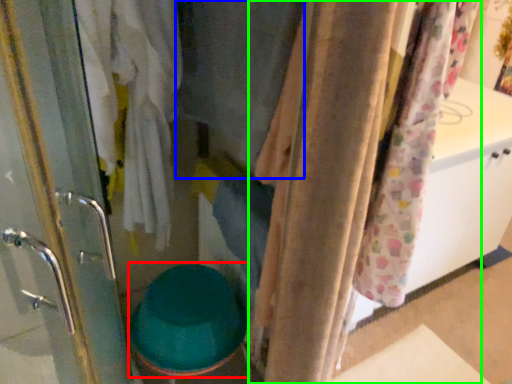
Question: Which is nearer to the toilet bowl (highlighted by a red box)? clothing (highlighted by a blue box) or curtain (highlighted by a green box).

Choices:
 (A) clothing
 (B) curtain

Answer: (B)